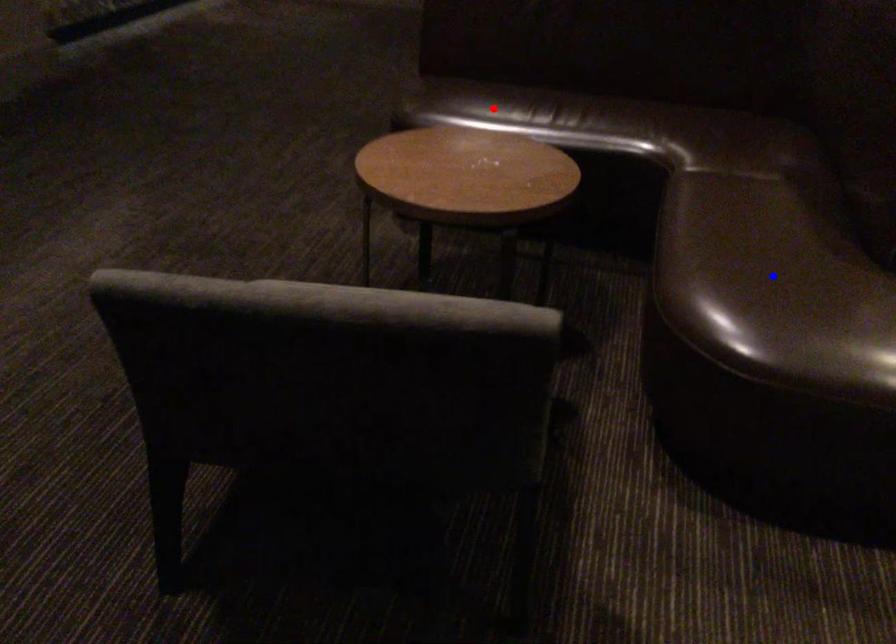
Question: Which of the two points in the image is closer to the camera?

Choices:
 (A) Blue point is closer.
 (B) Red point is closer.

Answer: (A)